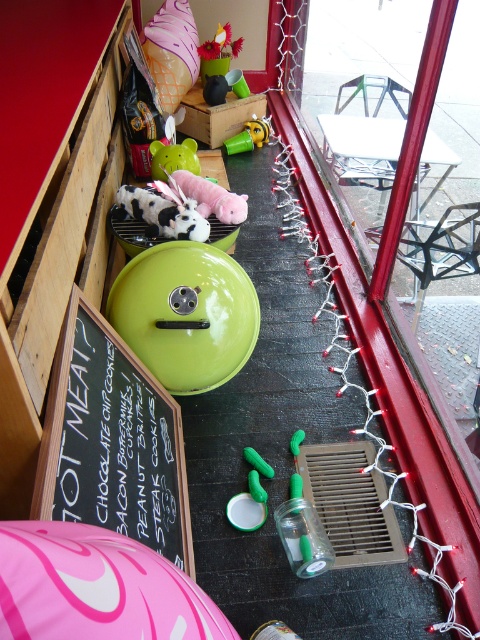
Between clear glass jar at lower left and green rubber toy at center, which one appears on the right side from the viewer's perspective?

Positioned to the right is clear glass jar at lower left.

Is point (271, 10) behind point (253, 481)?

Yes, it is.

You are a GUI agent. You are given a task and a screenshot of the screen. Output one action in this format:
    pyautogui.click(x=<x>, y=<y>)
    Task: Click on the clear glass jar at lower left
    The width and height of the screenshot is (480, 640).
    Given the screenshot: What is the action you would take?
    tap(381, 348)

Is point (386, 420) positioned in front of point (168, 157)?

Yes, it is in front of point (168, 157).

Who is higher up, clear glass jar at lower left or green rubber piggy bank at center?

green rubber piggy bank at center is higher up.

Which is behind, point (278, 131) or point (177, 145)?

Positioned behind is point (278, 131).

Locate an element on the screen. clear glass jar at lower left is located at coordinates (381, 348).

Identify the location of green glossy lid at center. This screenshot has height=640, width=480. (186, 314).

Who is positioned more to the left, green glossy lid at center or green rubber toy at center?

green glossy lid at center is more to the left.

I want to click on green glossy lid at center, so click(x=186, y=314).

At what (x,y) coordinates should I click in order to perform the action: click on green glossy lid at center. Please return your answer as a coordinate pair (x, y). The width and height of the screenshot is (480, 640). Looking at the image, I should click on (186, 314).